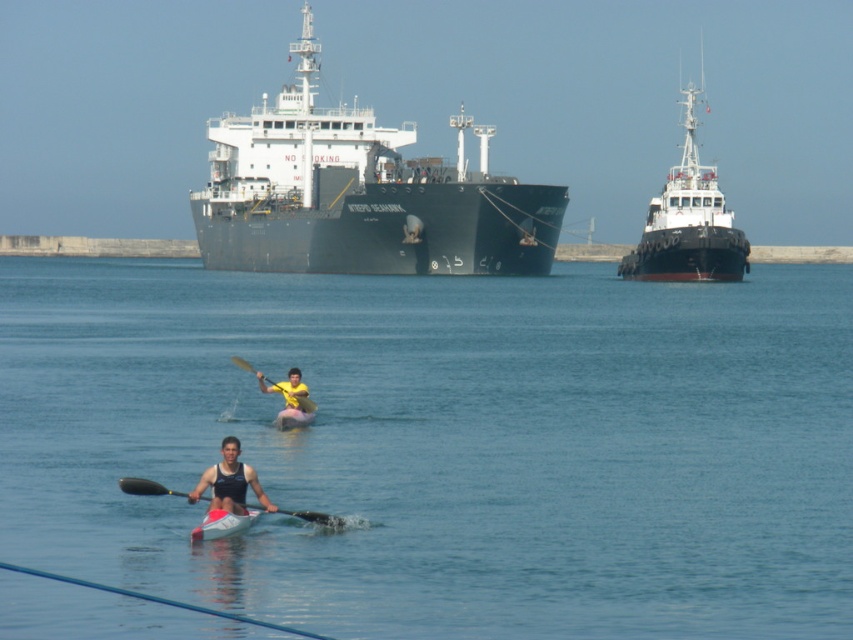
Question: Is clear blue water at center in front of matte black kayak at center?

Choices:
 (A) yes
 (B) no

Answer: (A)

Question: Is black plastic paddle at center thinner than yellow matte paddle at center?

Choices:
 (A) yes
 (B) no

Answer: (A)

Question: Which object appears closest to the camera in this image?

Choices:
 (A) white plastic canoe at center
 (B) yellow matte paddle at center

Answer: (A)

Question: Which object is the farthest from the black matte cargo ship at center?

Choices:
 (A) black plastic paddle at center
 (B) matte black kayak at center

Answer: (A)

Question: Which point is closer to the camera?

Choices:
 (A) (221, 532)
 (B) (262, 387)

Answer: (A)

Question: Is black matte cargo ship at center thinner than matte black kayak at center?

Choices:
 (A) yes
 (B) no

Answer: (B)